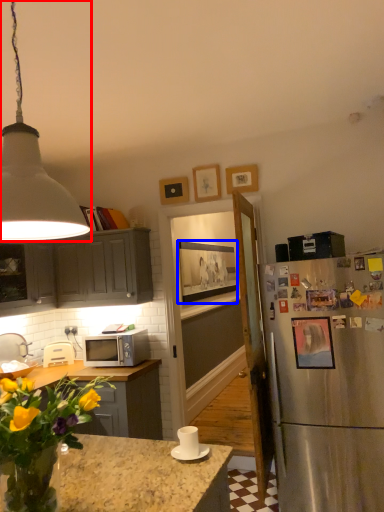
Question: Which object is closer to the camera taking this photo, lamp (highlighted by a red box) or picture frame (highlighted by a blue box)?

Choices:
 (A) lamp
 (B) picture frame

Answer: (A)